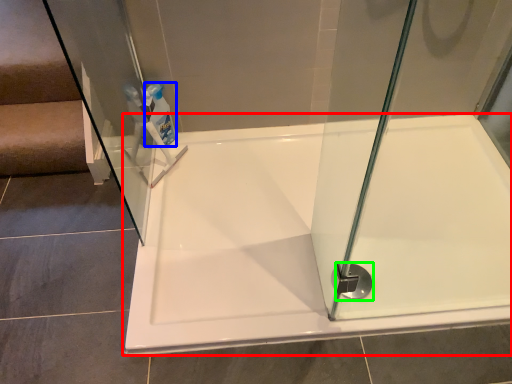
Question: Considering the real-world distances, which object is closest to bathtub (highlighted by a red box)? cleaning product (highlighted by a blue box) or shower (highlighted by a green box).

Choices:
 (A) cleaning product
 (B) shower

Answer: (B)